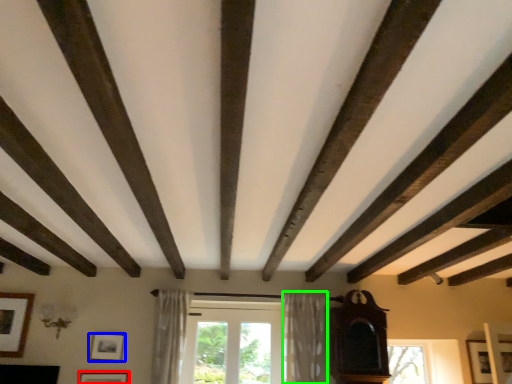
Question: Considering the real-world distances, which object is farthest from picture frame (highlighted by a red box)? picture frame (highlighted by a blue box) or curtain (highlighted by a green box)?

Choices:
 (A) picture frame
 (B) curtain

Answer: (B)